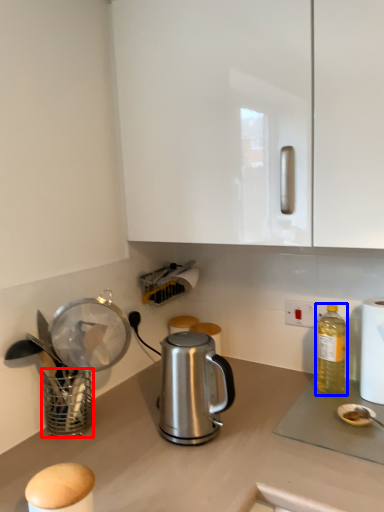
Question: Which object appears closest to the camera in this image, basket (highlighted by a red box) or bottle (highlighted by a blue box)?

Choices:
 (A) basket
 (B) bottle

Answer: (A)